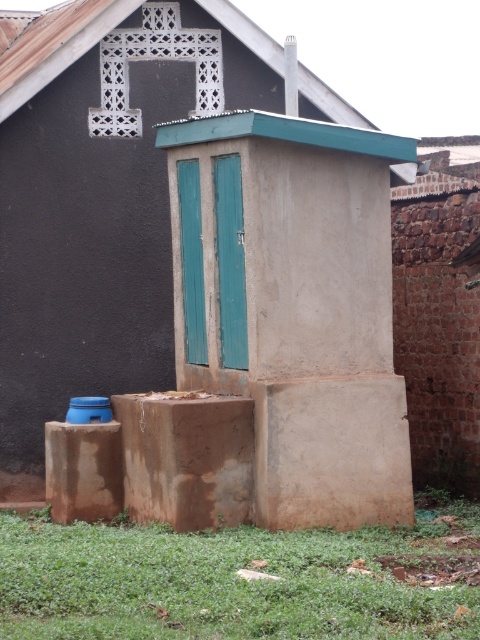
Does brown mud hut at center appear on the right side of green grass at lower center?

Correct, you'll find brown mud hut at center to the right of green grass at lower center.

Is point (410, 492) more distant than point (104, 593)?

Yes, it is.

Locate an element on the screen. The height and width of the screenshot is (640, 480). brown mud hut at center is located at coordinates (199, 244).